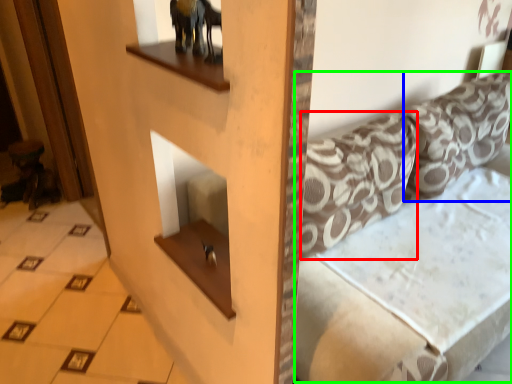
Question: Which object is positioned farthest from pillow (highlighted by a red box)? Select from pillow (highlighted by a blue box) and couch (highlighted by a green box).

Choices:
 (A) pillow
 (B) couch

Answer: (A)